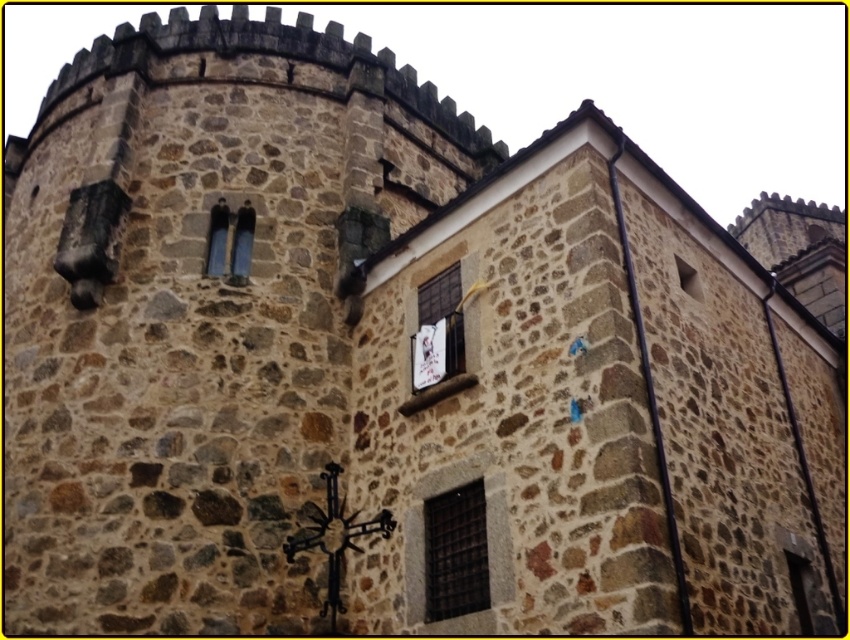
Is point (225, 259) farther from camera compared to point (684, 291)?

Yes, it is behind point (684, 291).

Does dark glass window at center left appear on the left side of clear glass window at upper right?

Indeed, dark glass window at center left is positioned on the left side of clear glass window at upper right.

What do you see at coordinates (231, 241) in the screenshot?
I see `dark glass window at center left` at bounding box center [231, 241].

Where is `dark glass window at center left`? dark glass window at center left is located at coordinates (231, 241).

Which is behind, point (456, 548) or point (690, 296)?

Positioned behind is point (690, 296).

Is dark gray metal grid at center taller than clear glass window at upper right?

Correct, dark gray metal grid at center is much taller as clear glass window at upper right.

Describe the element at coordinates (455, 552) in the screenshot. I see `dark gray metal grid at center` at that location.

The width and height of the screenshot is (850, 640). Find the location of `dark gray metal grid at center`. dark gray metal grid at center is located at coordinates (455, 552).

Which is below, white paper at center or dark glass window at center left?

white paper at center is lower down.

Is white paper at center positioned before dark glass window at center left?

Yes, it is.

Between point (420, 301) and point (217, 250), which one is positioned behind?

Positioned behind is point (217, 250).

Locate an element on the screen. This screenshot has width=850, height=640. white paper at center is located at coordinates (437, 330).